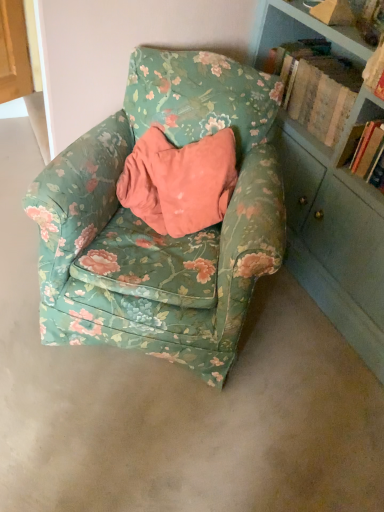
Question: Is hardcover book at right, positioned as the 1th book in bottom-to-top order, in front of or behind wooden book at upper right, positioned as the 2th book in bottom-to-top order, in the image?

Choices:
 (A) behind
 (B) front

Answer: (B)

Question: Is point (350, 168) positioned closer to the camera than point (306, 96)?

Choices:
 (A) farther
 (B) closer

Answer: (B)

Question: Which object is the closest to the floral fabric armchair at center?

Choices:
 (A) hardcover book at right, acting as the 2th book starting from the top
 (B) wooden book at upper right, positioned as the 2th book in bottom-to-top order

Answer: (B)

Question: Which is farther from the hardcover book at right, acting as the 2th book starting from the top?

Choices:
 (A) wooden book at upper right, the first book from the top
 (B) floral fabric armchair at center

Answer: (B)